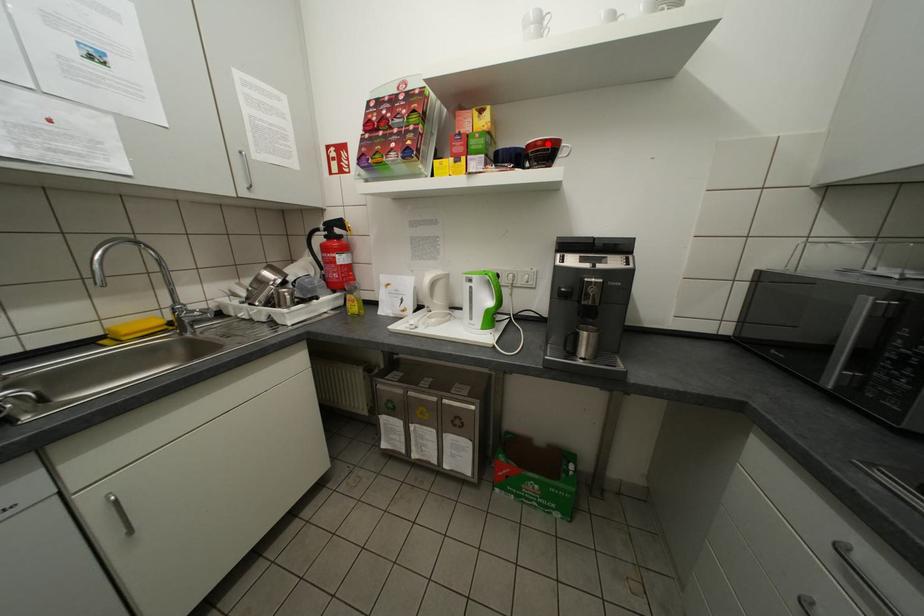
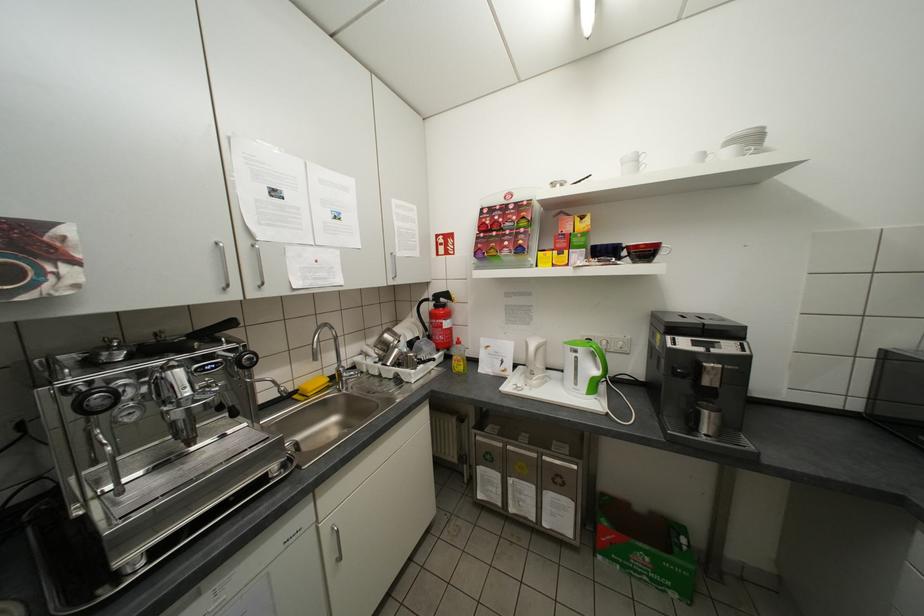
In the second image, find the point that corresponds to the highlighted location in the first image.

(650, 246)